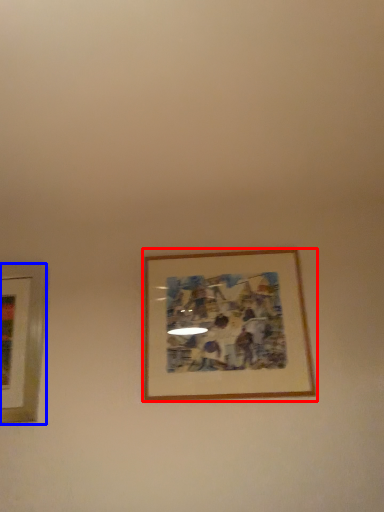
Question: Which object is further to the camera taking this photo, picture frame (highlighted by a red box) or picture frame (highlighted by a blue box)?

Choices:
 (A) picture frame
 (B) picture frame

Answer: (B)